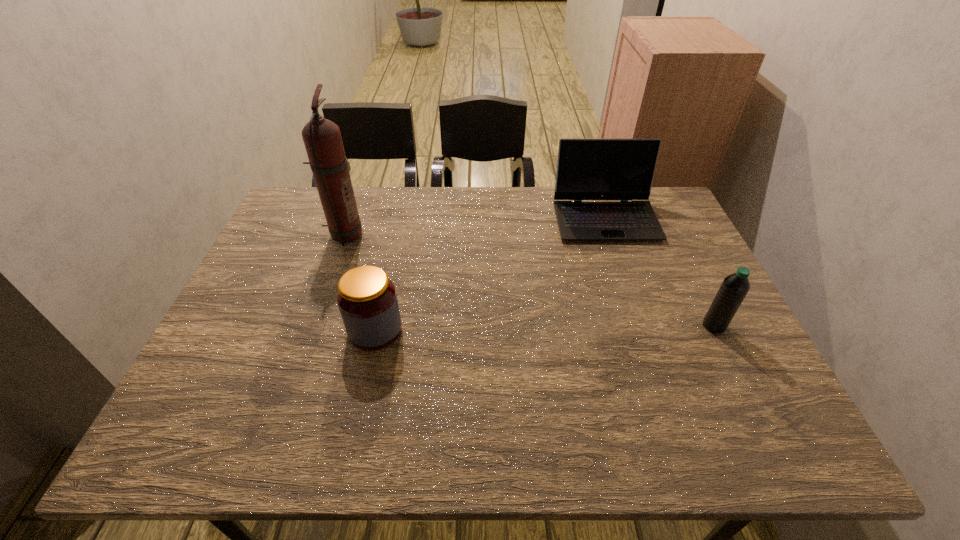
Find the location of `free point between the water bottle and the laptop computer`. free point between the water bottle and the laptop computer is located at coordinates (660, 272).

Choose which object is the third nearest neighbor to the water bottle. Please provide its 2D coordinates. Your answer should be formatted as a tuple, i.e. [(x, y)], where the tuple contains the x and y coordinates of a point satisfying the conditions above.

[(322, 138)]

Identify which object is the third closest to the water bottle. Please provide its 2D coordinates. Your answer should be formatted as a tuple, i.e. [(x, y)], where the tuple contains the x and y coordinates of a point satisfying the conditions above.

[(322, 138)]

What are the coordinates of `free space that satisfies the following two spatial constraints: 1. on the back side of the third object from right to left; 2. on the side of the tallest object with the label and nozzle` in the screenshot? It's located at (396, 234).

This screenshot has width=960, height=540. Find the location of `free space that satisfies the following two spatial constraints: 1. on the side of the third object from right to left with the label and nozzle; 2. on the right side of the fire extinguisher`. free space that satisfies the following two spatial constraints: 1. on the side of the third object from right to left with the label and nozzle; 2. on the right side of the fire extinguisher is located at coordinates (310, 330).

Find the location of `free point that satisfies the following two spatial constraints: 1. on the back side of the third object from right to left; 2. on the right side of the water bottle`. free point that satisfies the following two spatial constraints: 1. on the back side of the third object from right to left; 2. on the right side of the water bottle is located at coordinates (376, 326).

Locate an element on the screen. This screenshot has width=960, height=540. vacant space that satisfies the following two spatial constraints: 1. on the side of the tallest object with the label and nozzle; 2. on the right side of the second object from left to right is located at coordinates (310, 330).

I want to click on vacant space that satisfies the following two spatial constraints: 1. on the screen of the water bottle; 2. on the left side of the laptop computer, so coord(641,326).

At what (x,y) coordinates should I click in order to perform the action: click on free space that satisfies the following two spatial constraints: 1. on the back side of the water bottle; 2. on the side of the fire extinguisher with the label and nozzle. Please return your answer as a coordinate pair (x, y). Image resolution: width=960 pixels, height=540 pixels. Looking at the image, I should click on (669, 234).

Where is `vacant space that satisfies the following two spatial constraints: 1. on the side of the water bottle with the label and nozzle; 2. on the right side of the leftmost object`? Image resolution: width=960 pixels, height=540 pixels. vacant space that satisfies the following two spatial constraints: 1. on the side of the water bottle with the label and nozzle; 2. on the right side of the leftmost object is located at coordinates (311, 326).